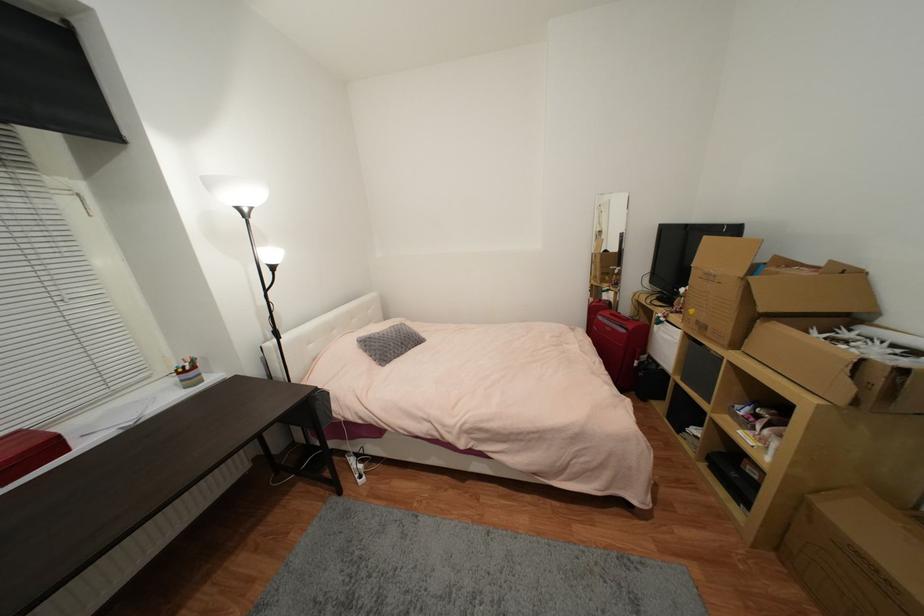
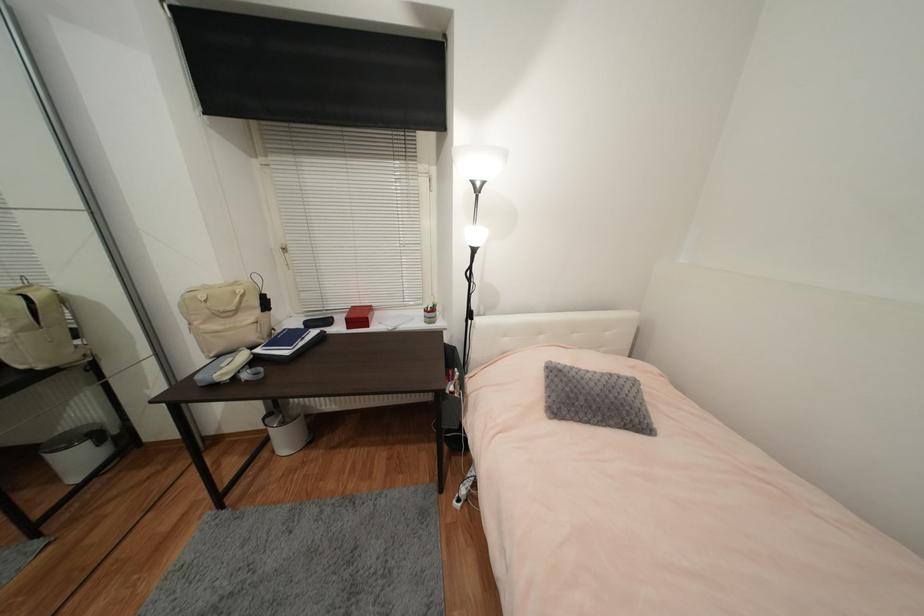
Find the pixel in the second image that matches point (185, 374) in the first image.

(430, 312)